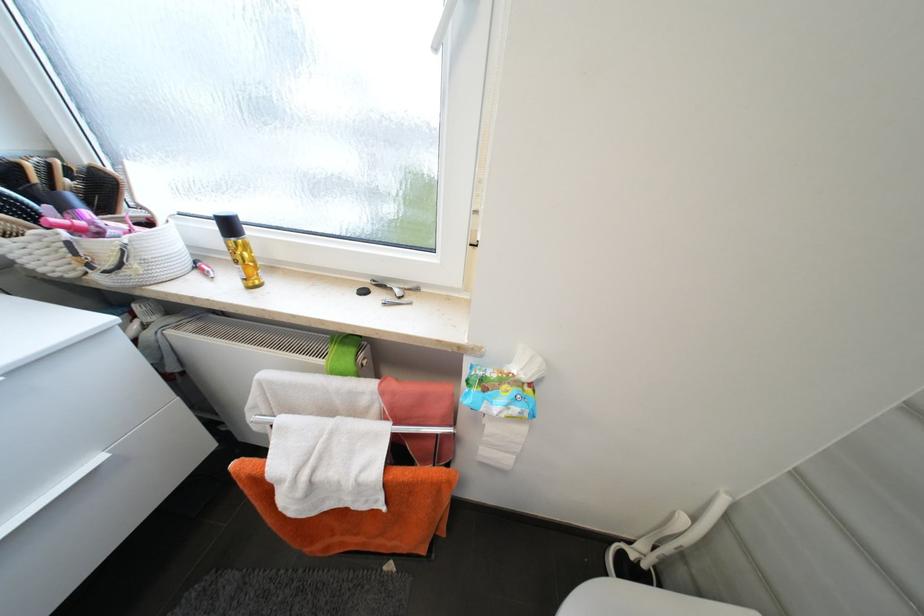
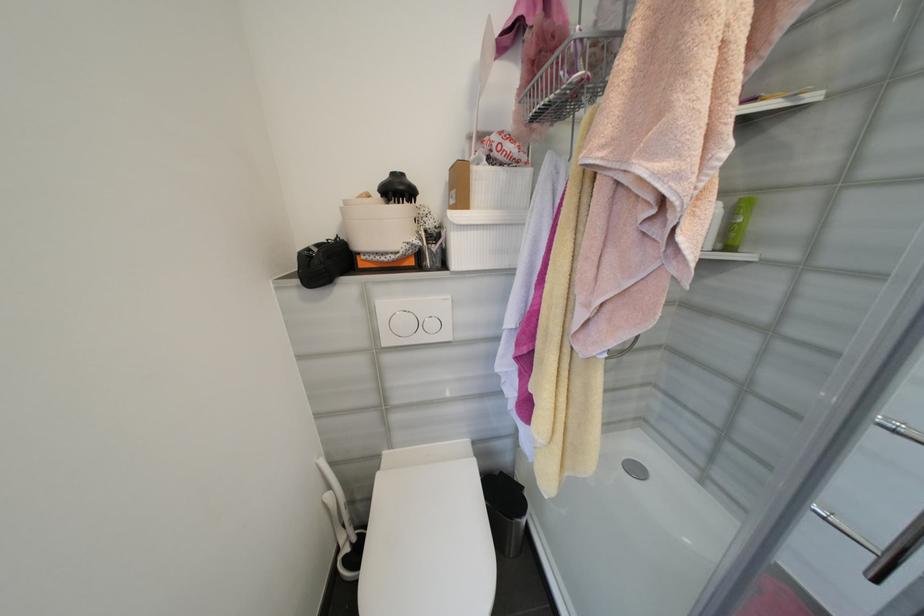
Based on the continuous images, in which direction is the camera rotating?

The rotation direction of the camera is right-down.